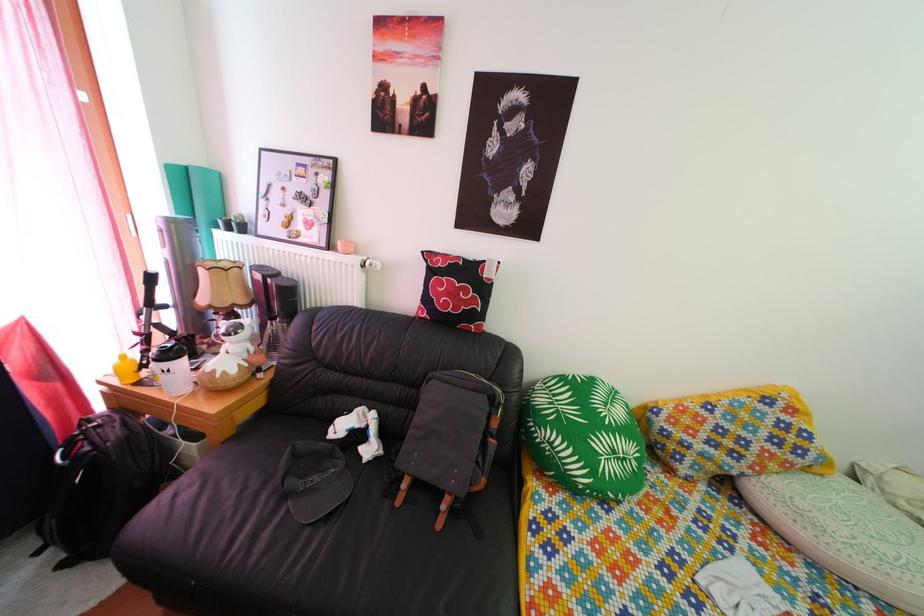
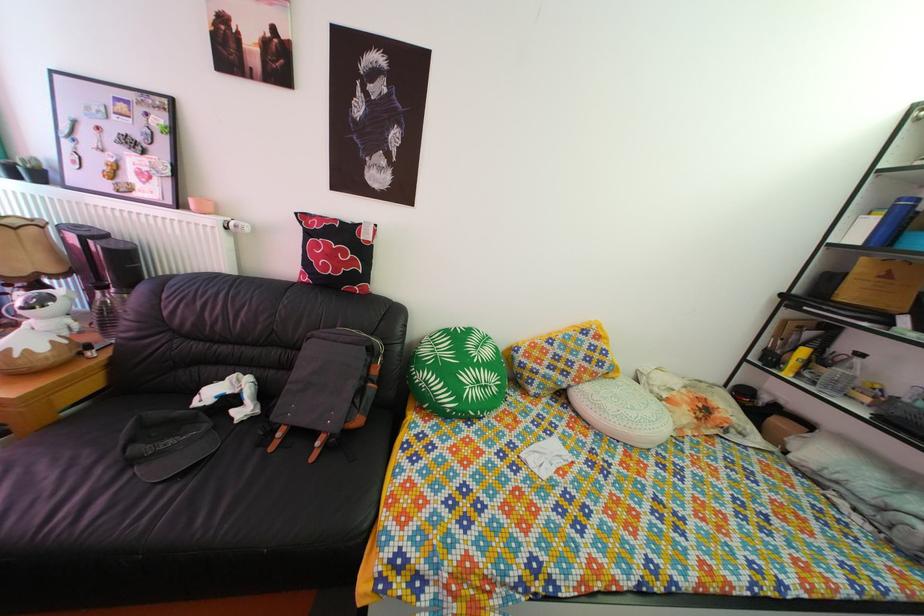
Locate, in the second image, the point that corresponds to pixel 407 511 in the first image.

(281, 456)